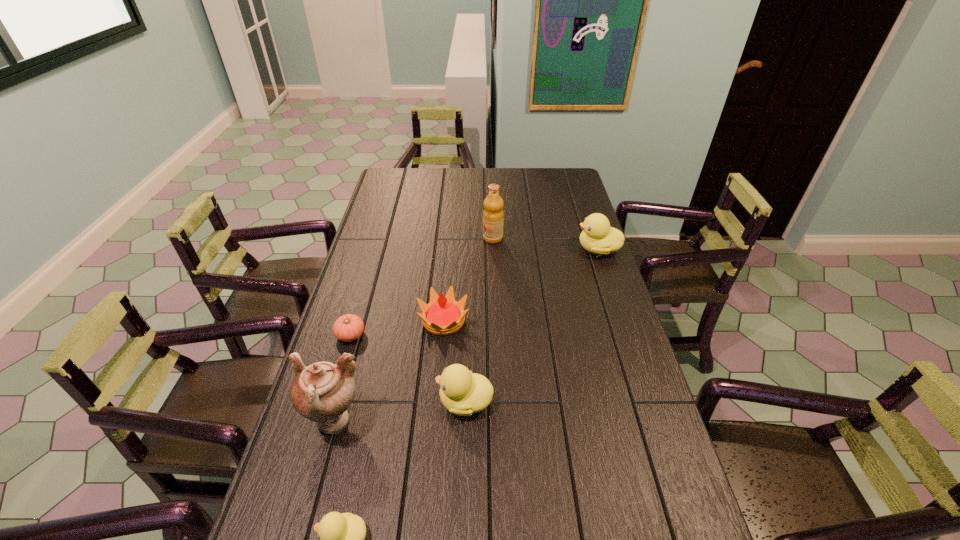
Find the location of a particular element. This screenshot has width=960, height=540. the second tallest duckling is located at coordinates (461, 392).

Find the location of a particular element. The height and width of the screenshot is (540, 960). the second nearest duckling is located at coordinates (461, 392).

Locate an element on the screen. The image size is (960, 540). the rightmost duckling is located at coordinates (597, 237).

You are a GUI agent. You are given a task and a screenshot of the screen. Output one action in this format:
    pyautogui.click(x=<x>, y=<y>)
    Task: Click on the farthest duckling
    
    Given the screenshot: What is the action you would take?
    pyautogui.click(x=597, y=237)

Find the location of `fruit juice`. fruit juice is located at coordinates (493, 215).

I want to click on the shortest object, so click(x=349, y=327).

The height and width of the screenshot is (540, 960). I want to click on crown, so click(x=443, y=315).

Where is `urn`? urn is located at coordinates (x=322, y=392).

Find the location of a particular element. This screenshot has height=540, width=960. blank space located at the beak of the second tallest duckling is located at coordinates (325, 401).

The height and width of the screenshot is (540, 960). In order to click on vacant space located 0.220m at the beak of the second tallest duckling in this screenshot , I will do `click(355, 401)`.